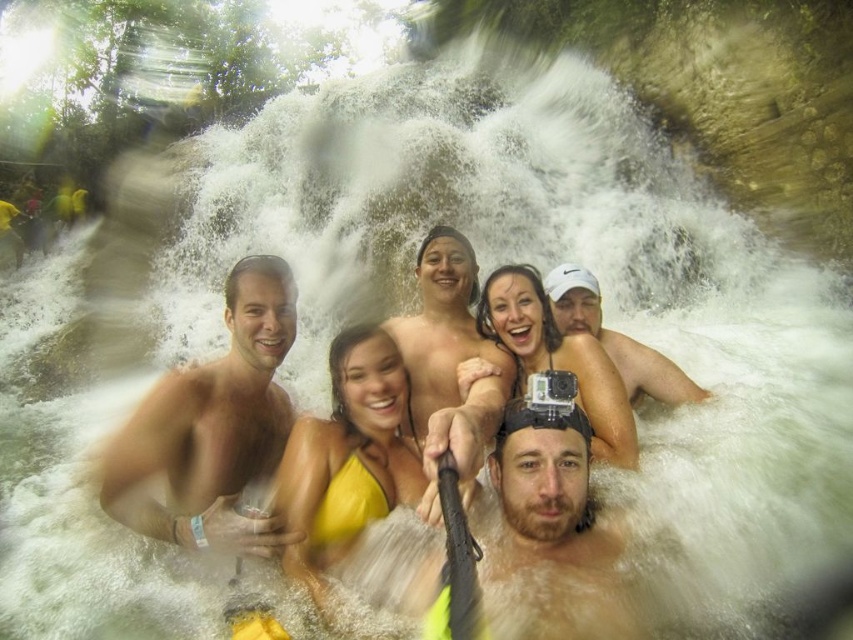
Question: Does bearded man at center have a lesser width compared to white matte camera at center?

Choices:
 (A) no
 (B) yes

Answer: (A)

Question: Which of the following is the closest to the observer?

Choices:
 (A) yellow fabric bikini at center
 (B) bearded man at center
 (C) smooth skin man at center

Answer: (B)

Question: Which of the following is the closest to the observer?

Choices:
 (A) (x=331, y=557)
 (B) (x=268, y=432)

Answer: (A)

Question: Is bearded man at center to the left of white matte camera at center from the viewer's perspective?

Choices:
 (A) yes
 (B) no

Answer: (A)

Question: Does bearded man at center have a smaller size compared to white matte camera at center?

Choices:
 (A) no
 (B) yes

Answer: (A)

Question: Which point is farther to the camera?

Choices:
 (A) (598, 292)
 (B) (401, 381)
 (C) (602, 403)
 (D) (558, 474)

Answer: (A)